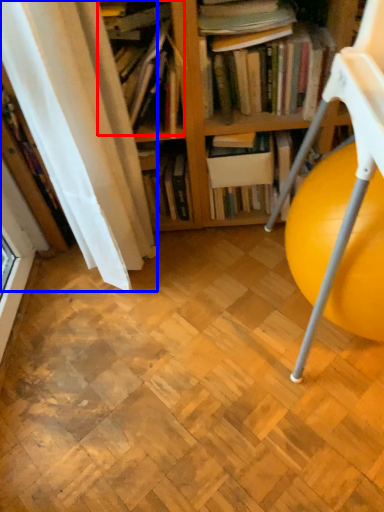
Question: Which point is closer to the camera, book (highlighted by a red box) or curtain (highlighted by a blue box)?

Choices:
 (A) book
 (B) curtain

Answer: (B)